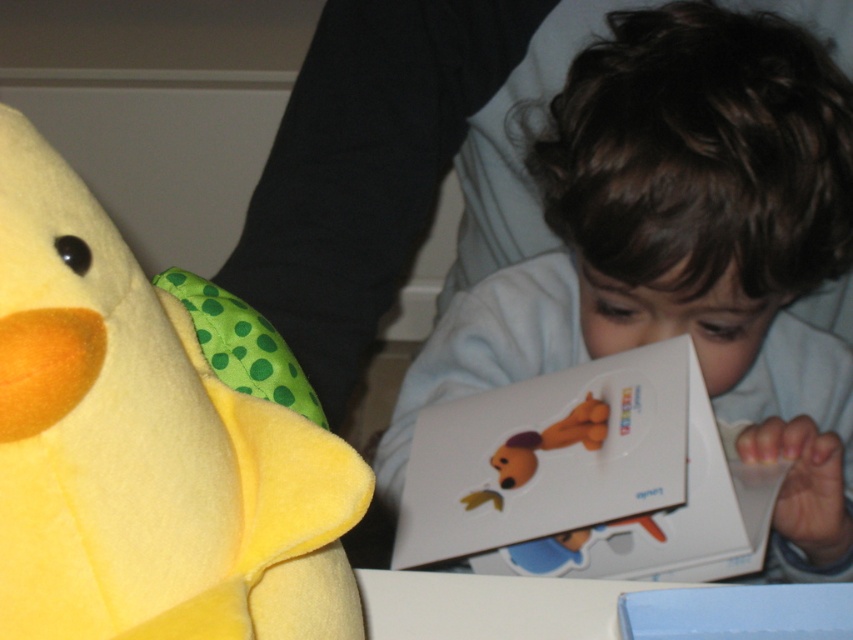
You are a photographer setting up a shot of the smooth white shirt at center and the yellow felt plush toy at left. Which object should you focus on first if you want to ensure both are in focus without moving the camera?

You should focus on the smooth white shirt at center first because it is closer to the viewer than the yellow felt plush toy at left, so adjusting focus starting from the closer object ensures both can be in focus.

You are a photographer trying to capture the child and the book in the image. The focus point of your camera is set to point at coordinates point [683,250]. According to the scene, what object or area will be in focus?

The point [683,250] is on smooth white shirt at center, so the focus will be on the smooth white shirt at center.